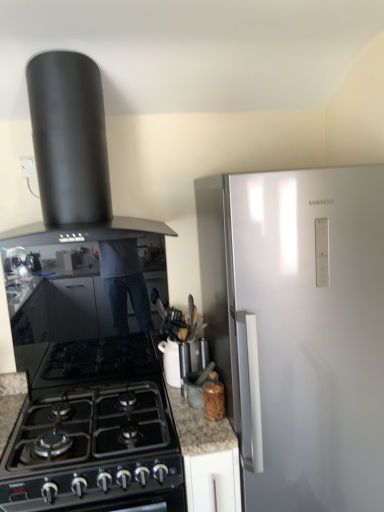
Locate an element on the screen. free space that is to the left of brown glass bottle at lower center, acting as the 3th kitchen appliance starting from the top is located at coordinates (196, 419).